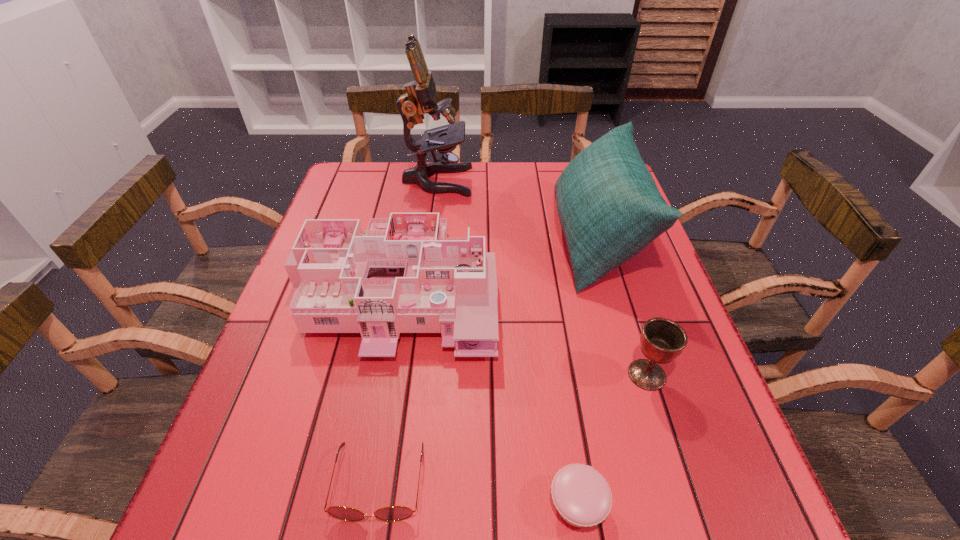
Find the location of a particular element. This screenshot has height=540, width=960. vacant region that satisfies the following two spatial constraints: 1. on the lenses of the sunglasses; 2. on the right side of the cupcake is located at coordinates (375, 504).

Locate an element on the screen. vacant space that satisfies the following two spatial constraints: 1. at the eyepieces of the microscope; 2. on the back side of the cupcake is located at coordinates (395, 504).

This screenshot has height=540, width=960. Identify the location of free location that satisfies the following two spatial constraints: 1. at the eyepieces of the microscope; 2. on the lenses of the sunglasses. (397, 483).

In order to click on free location that satisfies the following two spatial constraints: 1. at the eyepieces of the microscope; 2. on the left side of the chalice in this screenshot , I will do `click(412, 375)`.

The height and width of the screenshot is (540, 960). I want to click on free spot that satisfies the following two spatial constraints: 1. on the back side of the chalice; 2. on the left side of the cupcake, so click(x=558, y=375).

You are a GUI agent. You are given a task and a screenshot of the screen. Output one action in this format:
    pyautogui.click(x=<x>, y=<y>)
    Task: Click on the blank area in the image that satisfies the following two spatial constraints: 1. at the eyepieces of the tallest object; 2. at the front entrance of the dollhouse
    
    Given the screenshot: What is the action you would take?
    pyautogui.click(x=423, y=288)